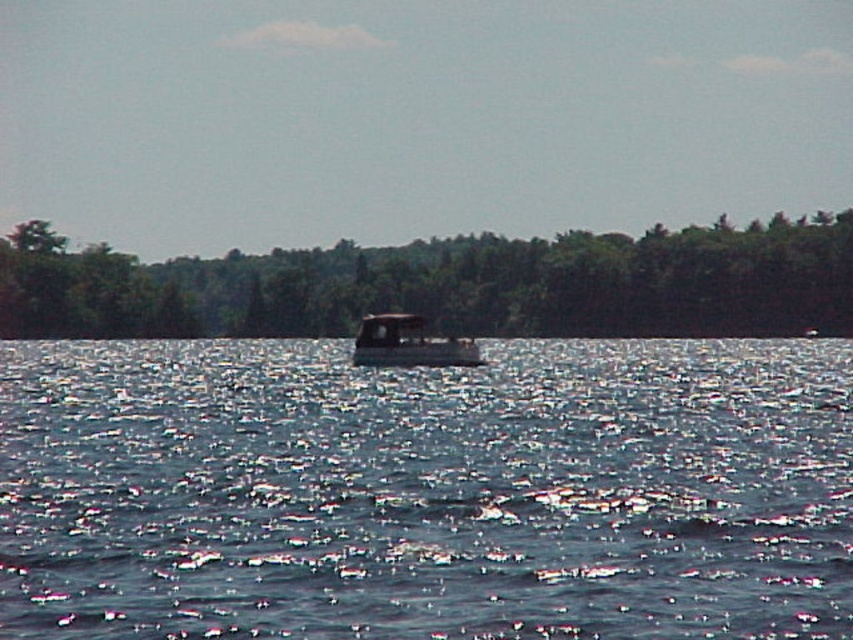
Who is lower down, blue water at center or green matte tree at center?

blue water at center

Who is positioned more to the right, blue water at center or green matte tree at center?

→ From the viewer's perspective, green matte tree at center appears more on the right side.

Image resolution: width=853 pixels, height=640 pixels. In order to click on blue water at center in this screenshot , I will do `click(426, 492)`.

Does blue water at center appear under metallic gray boat at center?

Indeed, blue water at center is positioned under metallic gray boat at center.

What are the coordinates of `blue water at center` in the screenshot? It's located at (426, 492).

The height and width of the screenshot is (640, 853). I want to click on blue water at center, so click(x=426, y=492).

The width and height of the screenshot is (853, 640). I want to click on blue water at center, so click(426, 492).

Does green matte tree at center have a larger size compared to metallic gray boat at center?

Yes, green matte tree at center is bigger than metallic gray boat at center.

Measure the distance between point [148,300] and camera.

Point [148,300] is 138.29 meters from camera.

The width and height of the screenshot is (853, 640). What are the coordinates of `green matte tree at center` in the screenshot? It's located at (453, 285).